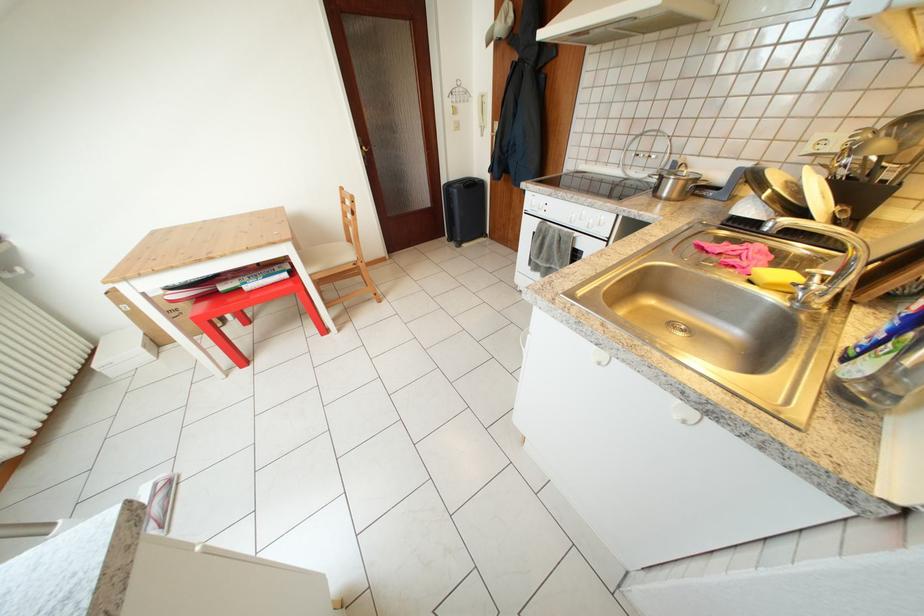
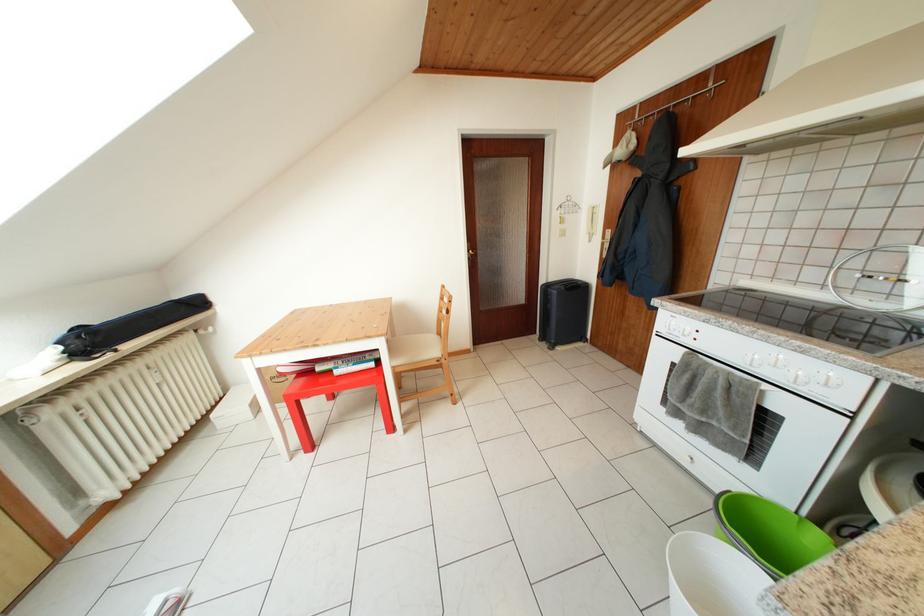
The point at (453, 185) is marked in the first image. Where is the corresponding point in the second image?

(551, 286)